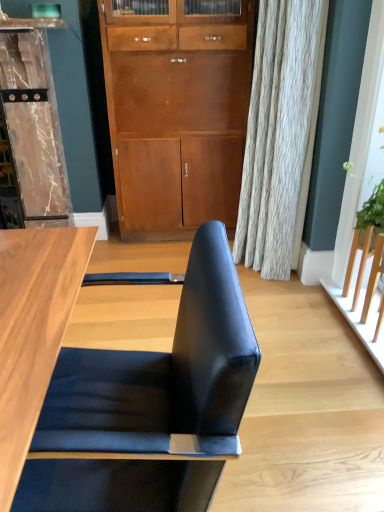
What is the approximate height of marble/textured dresser at left?

It is 4.05 feet.

In order to click on black leather chair at center in this screenshot , I will do `click(150, 405)`.

Locate an element on the screen. marble/textured dresser at left is located at coordinates (33, 122).

From the picture: Is marble/textured dresser at left oriented towards matte wood cabinet at center?

No, marble/textured dresser at left is not aimed at matte wood cabinet at center.

Would you say marble/textured dresser at left is to the left or to the right of matte wood cabinet at center in the picture?

In the image, marble/textured dresser at left appears on the left side of matte wood cabinet at center.

Locate an element on the screen. dresser on the left of matte wood cabinet at center is located at coordinates (33, 122).

Does point (32, 182) come farther from viewer compared to point (129, 101)?

Yes, it is behind point (129, 101).

Considering the relative positions of marble/textured dresser at left and black leather chair at center in the image provided, is marble/textured dresser at left to the right of black leather chair at center from the viewer's perspective?

No.

Where is `dresser lying behind the black leather chair at center`? Image resolution: width=384 pixels, height=512 pixels. dresser lying behind the black leather chair at center is located at coordinates (33, 122).

Does marble/textured dresser at left lie in front of black leather chair at center?

No, the depth of marble/textured dresser at left is greater than that of black leather chair at center.

Is black leather chair at center not inside marble/textured dresser at left?

Absolutely, black leather chair at center is external to marble/textured dresser at left.

Is black leather chair at center oriented away from marble/textured dresser at left?

black leather chair at center does not have its back to marble/textured dresser at left.

Consider the image. Considering the positions of objects black leather chair at center and marble/textured dresser at left in the image provided, who is more to the left, black leather chair at center or marble/textured dresser at left?

From the viewer's perspective, marble/textured dresser at left appears more on the left side.

Are black leather chair at center and marble/textured dresser at left making contact?

No, black leather chair at center is not in contact with marble/textured dresser at left.

From a real-world perspective, is matte wood cabinet at center under black leather chair at center?

Incorrect, from a real-world perspective, matte wood cabinet at center is higher than black leather chair at center.

From the image's perspective, which one is positioned lower, matte wood cabinet at center or black leather chair at center?

black leather chair at center.

Is matte wood cabinet at center shorter than black leather chair at center?

In fact, matte wood cabinet at center may be taller than black leather chair at center.

Which is more to the left, black leather chair at center or matte wood cabinet at center?

From the viewer's perspective, black leather chair at center appears more on the left side.

How distant is black leather chair at center from matte wood cabinet at center?

The distance of black leather chair at center from matte wood cabinet at center is 6.06 feet.

Is point (241, 330) in front of point (193, 192)?

Yes, point (241, 330) is in front of point (193, 192).

Considering the relative sizes of black leather chair at center and matte wood cabinet at center in the image provided, is black leather chair at center smaller than matte wood cabinet at center?

Yes.

From a real-world perspective, which object rests below the other?

marble/textured dresser at left, from a real-world perspective.

Is marble/textured dresser at left located within matte wood cabinet at center?

No, marble/textured dresser at left is not a part of matte wood cabinet at center.

Looking at this image, considering the sizes of objects matte wood cabinet at center and marble/textured dresser at left in the image provided, who is wider, matte wood cabinet at center or marble/textured dresser at left?

marble/textured dresser at left.

How much distance is there between matte wood cabinet at center and marble/textured dresser at left?

matte wood cabinet at center and marble/textured dresser at left are 23.33 inches apart.

Identify the location of dresser on the left of matte wood cabinet at center. (33, 122).

You are a GUI agent. You are given a task and a screenshot of the screen. Output one action in this format:
    pyautogui.click(x=<x>, y=<y>)
    Task: Click on the chair that appears on the right of marble/textured dresser at left
    This screenshot has width=384, height=512.
    Given the screenshot: What is the action you would take?
    pyautogui.click(x=150, y=405)

Estimate the real-world distances between objects in this image. Which object is further from matte wood cabinet at center, black leather chair at center or marble/textured dresser at left?

black leather chair at center is further to matte wood cabinet at center.

From the image, which object appears to be farther from marble/textured dresser at left, black leather chair at center or matte wood cabinet at center?

black leather chair at center lies further to marble/textured dresser at left than the other object.

When comparing their distances from black leather chair at center, does marble/textured dresser at left or matte wood cabinet at center seem closer?

matte wood cabinet at center.

Based on their spatial positions, is marble/textured dresser at left or black leather chair at center closer to matte wood cabinet at center?

marble/textured dresser at left is closer to matte wood cabinet at center.

From the image, which object appears to be nearer to black leather chair at center, matte wood cabinet at center or marble/textured dresser at left?

Based on the image, matte wood cabinet at center appears to be nearer to black leather chair at center.

When comparing their distances from marble/textured dresser at left, does matte wood cabinet at center or black leather chair at center seem further?

black leather chair at center.

Where is `dresser between black leather chair at center and matte wood cabinet at center in the front-back direction`? This screenshot has width=384, height=512. dresser between black leather chair at center and matte wood cabinet at center in the front-back direction is located at coordinates (33, 122).